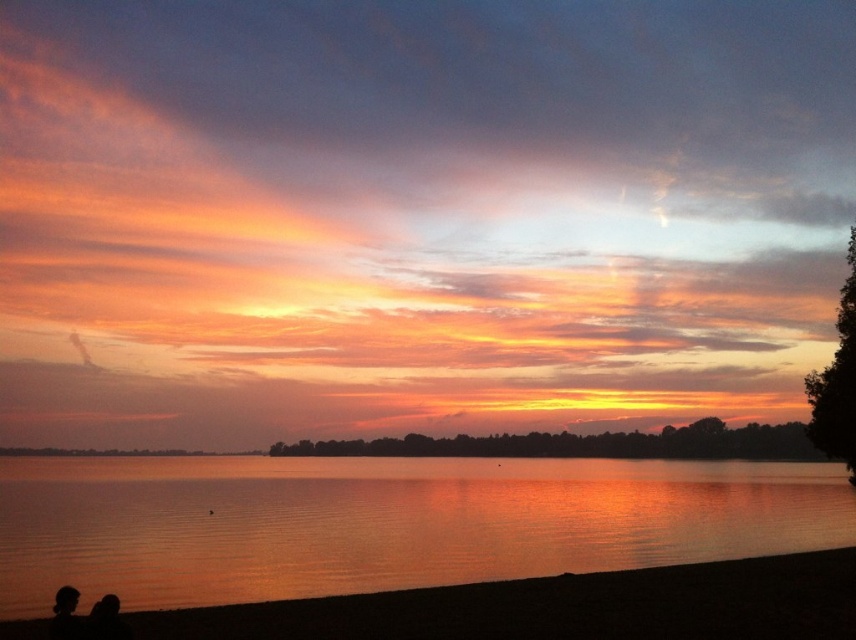
You are a photographer capturing the sunset scene. You notice two objects in the lower left corner of the image. One is the silhouette couple at lower left and the other is the silhouette skin at lower left. Which object is closer to the camera based on their positions?

The silhouette couple at lower left is positioned over the silhouette skin at lower left, meaning the silhouette couple at lower left is closer to the camera.

You are an observer looking at the sunset scene. You notice two silhouettes at the lower left of the image. Which one is positioned more to the right between the silhouette couple at lower left and the silhouette skin at lower left?

The silhouette couple at lower left is positioned more to the right compared to the silhouette skin at lower left according to the description.